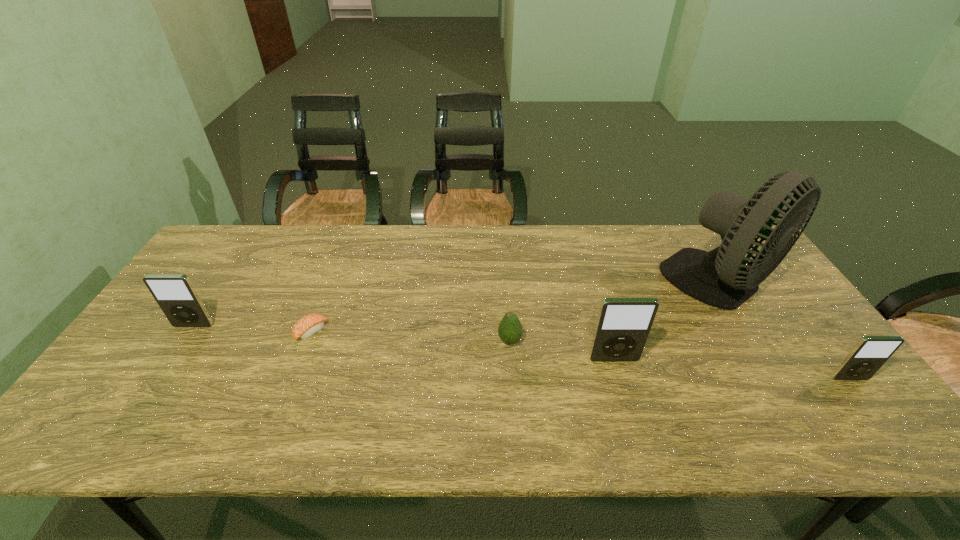
Point out which iPod is positioned as the second nearest to the fifth object from right to left. Please provide its 2D coordinates. Your answer should be formatted as a tuple, i.e. [(x, y)], where the tuple contains the x and y coordinates of a point satisfying the conditions above.

[(623, 325)]

I want to click on iPod that stands as the closest to the fifth farthest object, so click(870, 353).

I want to click on vacant area that satisfies the following two spatial constraints: 1. on the front-facing side of the leftmost iPod; 2. on the left side of the second shortest object, so click(x=183, y=341).